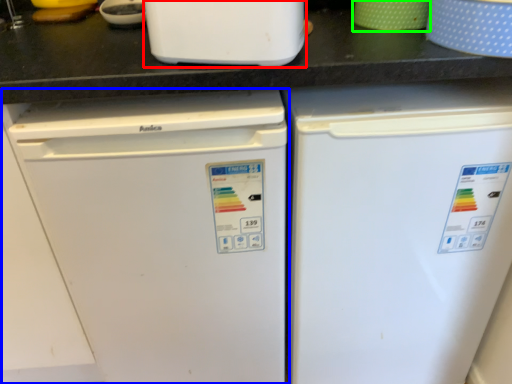
Question: Estimate the real-world distances between objects in this image. Which object is closer to home appliance (highlighted by a red box), refrigerator (highlighted by a blue box) or appliance (highlighted by a green box)?

Choices:
 (A) refrigerator
 (B) appliance

Answer: (B)